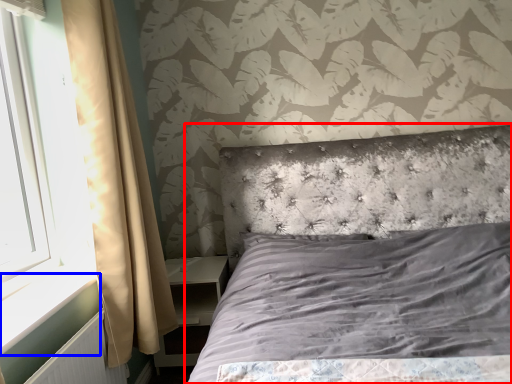
Question: Which object appears farthest to the camera in this image, bed (highlighted by a red box) or window sill (highlighted by a blue box)?

Choices:
 (A) bed
 (B) window sill

Answer: (B)